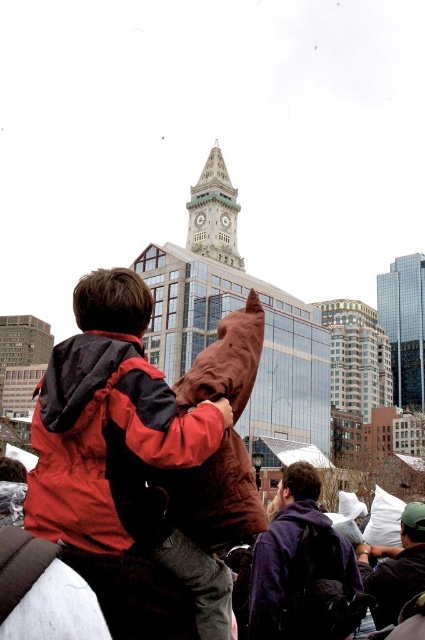
Which of these two, dark gray hoodie at lower right or green stone clock tower at center, stands taller?

green stone clock tower at center is taller.

Does dark gray hoodie at lower right appear under green stone clock tower at center?

Indeed, dark gray hoodie at lower right is positioned under green stone clock tower at center.

Where is `dark gray hoodie at lower right`? dark gray hoodie at lower right is located at coordinates (394, 566).

Does dark blue fleece jacket at center come in front of dark gray hoodie at lower right?

A: Yes, it is in front of dark gray hoodie at lower right.

Find the location of a particular element. Image resolution: width=425 pixels, height=640 pixels. dark blue fleece jacket at center is located at coordinates (280, 547).

Based on the photo, who is more distant from viewer, [350,579] or [382,579]?

The point [382,579] is behind.

Find the location of `dark blue fleece jacket at center`. dark blue fleece jacket at center is located at coordinates (280, 547).

Is matte brown pillow at center bigger than green stone clock tower at center?

Incorrect, matte brown pillow at center is not larger than green stone clock tower at center.

In the scene shown: Which is more to the right, matte brown pillow at center or green stone clock tower at center?

From the viewer's perspective, green stone clock tower at center appears more on the right side.

What do you see at coordinates (121, 445) in the screenshot? I see `matte brown pillow at center` at bounding box center [121, 445].

This screenshot has width=425, height=640. Identify the location of matte brown pillow at center. (121, 445).